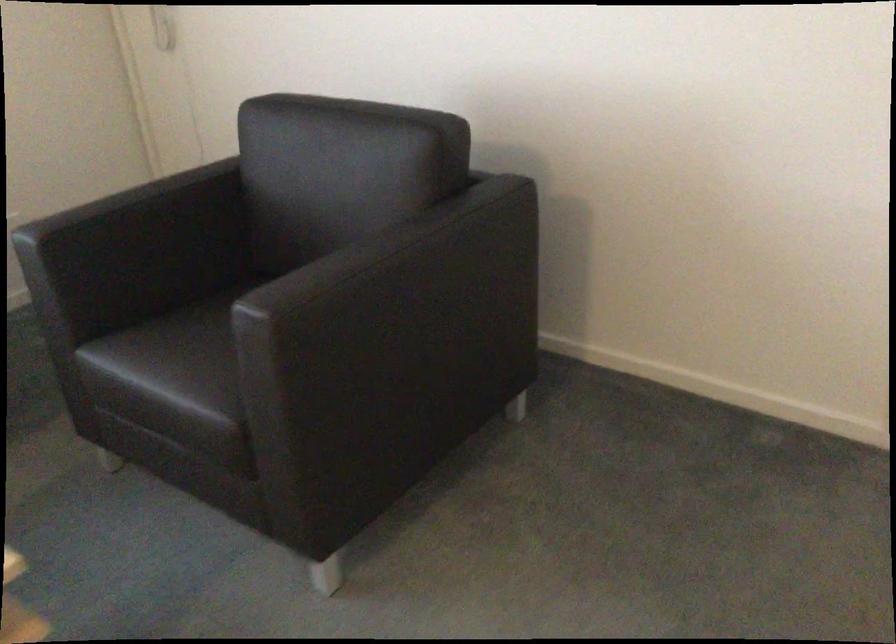
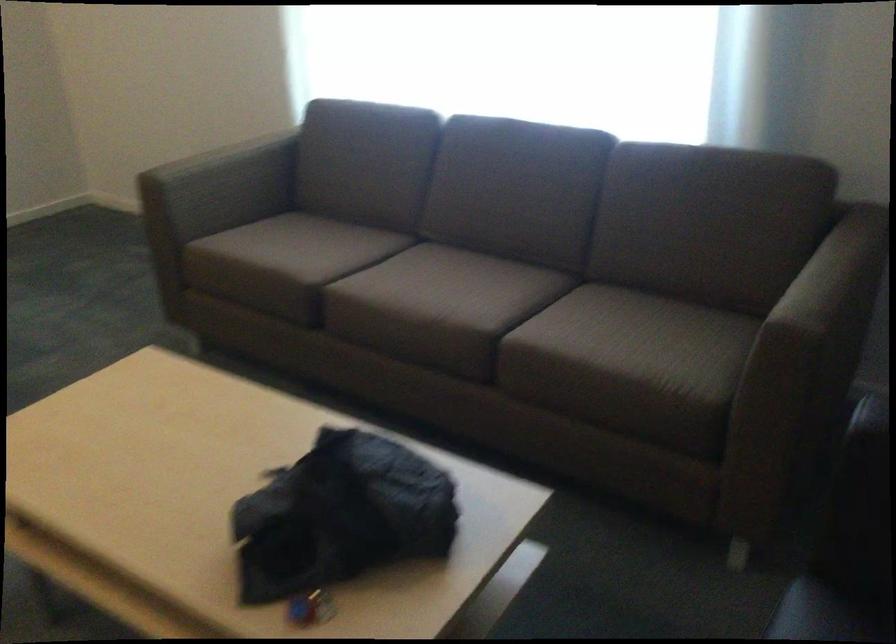
Based on the continuous images, in which direction is the camera rotating?

The camera's rotation is toward left-down.